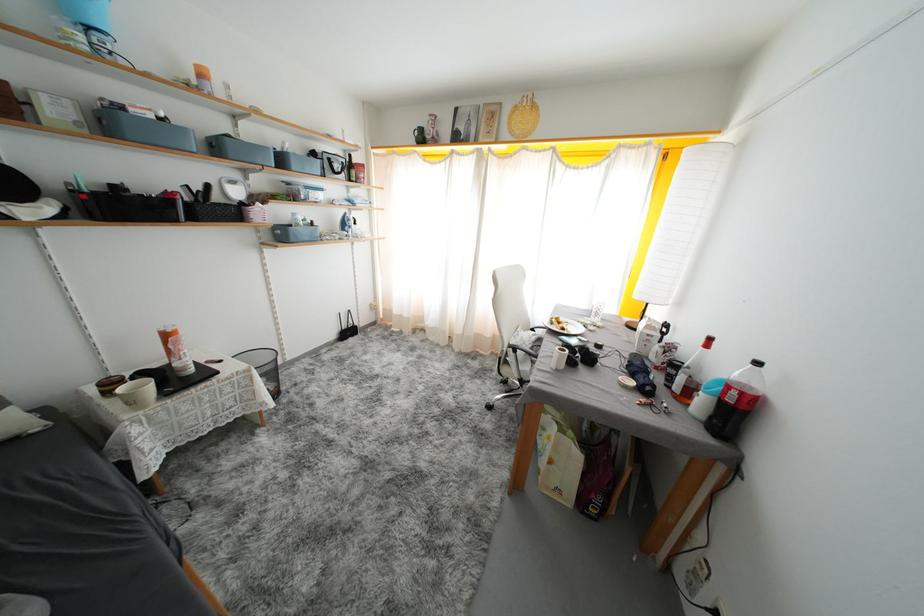
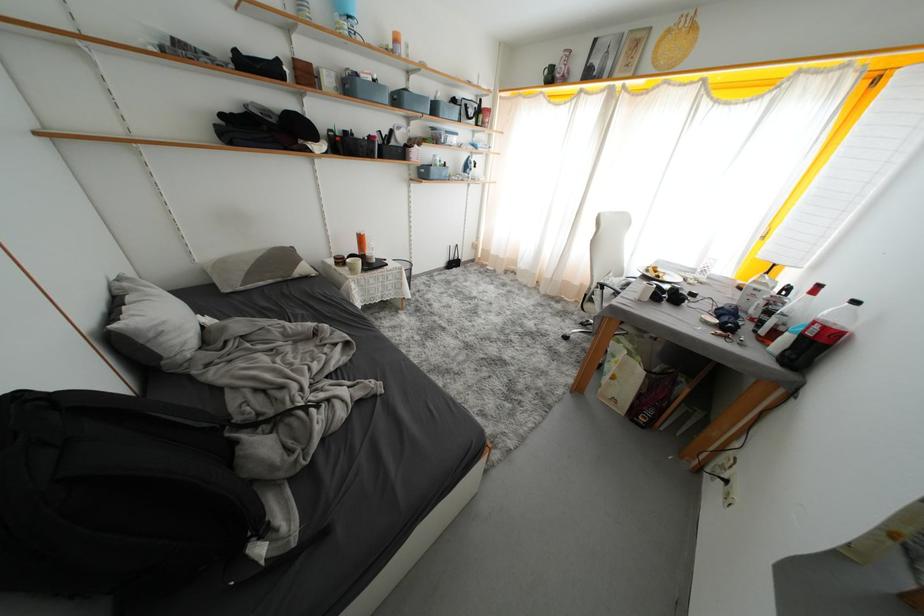
In the second image, find the point that corresponds to [223,151] in the first image.

(404, 103)